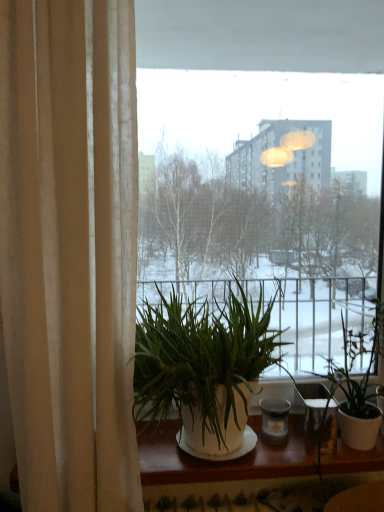
Where is `free space to the left of green leafy plant at right, which ranks as the first houseplant in right-to-left order`? free space to the left of green leafy plant at right, which ranks as the first houseplant in right-to-left order is located at coordinates (284, 443).